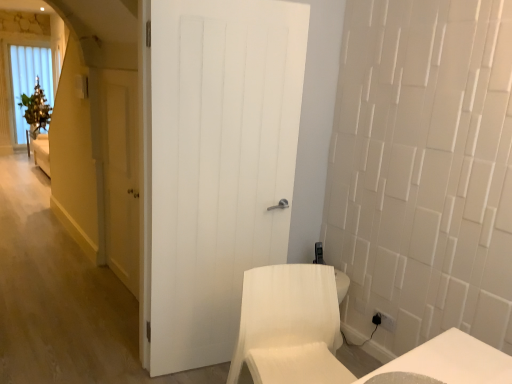
Question: Does yellow matte door at left, the 2th door in the right-to-left sequence, lie behind white fabric chair at lower right?

Choices:
 (A) yes
 (B) no

Answer: (A)

Question: From the image's perspective, would you say yellow matte door at left, the 2th door in the front-to-back sequence, is positioned over white fabric chair at lower right?

Choices:
 (A) yes
 (B) no

Answer: (A)

Question: Is yellow matte door at left, the 2th door in the front-to-back sequence, turned away from white fabric chair at lower right?

Choices:
 (A) yes
 (B) no

Answer: (B)

Question: Can you confirm if yellow matte door at left, the 2th door in the right-to-left sequence, is shorter than white fabric chair at lower right?

Choices:
 (A) no
 (B) yes

Answer: (A)

Question: Are yellow matte door at left, positioned as the 1th door in back-to-front order, and white fabric chair at lower right making contact?

Choices:
 (A) no
 (B) yes

Answer: (A)

Question: Considering the positions of white fabric chair at lower right and white wooden door at center, which ranks as the 1th door in right-to-left order, in the image, is white fabric chair at lower right wider or thinner than white wooden door at center, which ranks as the 1th door in right-to-left order,?

Choices:
 (A) thin
 (B) wide

Answer: (B)

Question: In terms of height, does white fabric chair at lower right look taller or shorter compared to white wooden door at center, the second door when ordered from back to front?

Choices:
 (A) tall
 (B) short

Answer: (B)

Question: From a real-world perspective, is white fabric chair at lower right positioned above or below white wooden door at center, the 2th door when ordered from left to right?

Choices:
 (A) above
 (B) below

Answer: (B)

Question: Is point (298, 352) closer or farther from the camera than point (159, 137)?

Choices:
 (A) closer
 (B) farther

Answer: (A)

Question: Looking at their shapes, would you say white fabric chair at lower right is wider or thinner than yellow matte door at left, the 2th door in the front-to-back sequence?

Choices:
 (A) wide
 (B) thin

Answer: (A)

Question: In the image, is white fabric chair at lower right on the left side or the right side of yellow matte door at left, the 2th door in the front-to-back sequence?

Choices:
 (A) left
 (B) right

Answer: (B)

Question: From a real-world perspective, relative to yellow matte door at left, the 2th door in the right-to-left sequence, is white fabric chair at lower right vertically above or below?

Choices:
 (A) above
 (B) below

Answer: (B)

Question: From the image's perspective, is white fabric chair at lower right above or below yellow matte door at left, the 2th door in the right-to-left sequence?

Choices:
 (A) below
 (B) above

Answer: (A)

Question: In the image, is yellow matte door at left, arranged as the 1th door when viewed from the left, positioned in front of or behind white fabric chair at lower right?

Choices:
 (A) behind
 (B) front

Answer: (A)

Question: Is point (136, 286) closer or farther from the camera than point (288, 301)?

Choices:
 (A) closer
 (B) farther

Answer: (B)